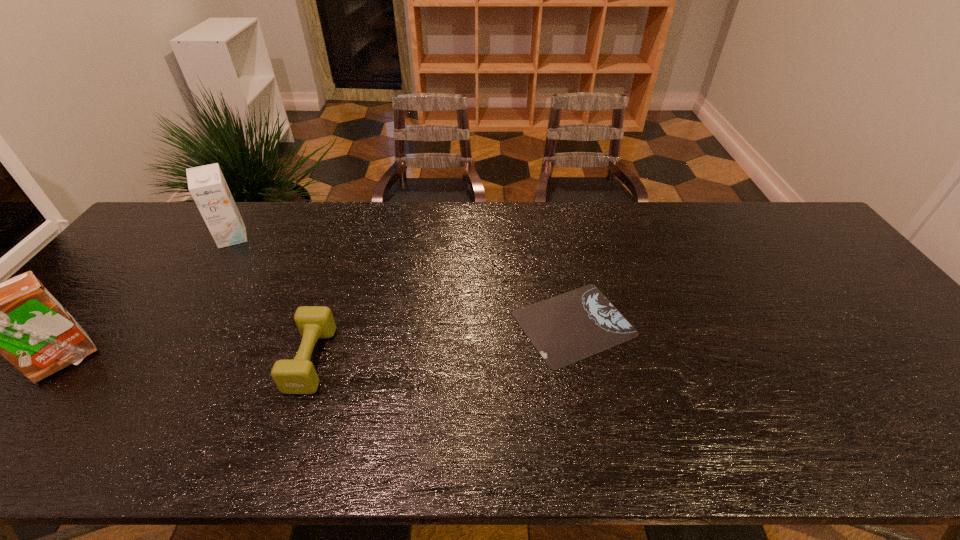
Locate an element on the screen. The width and height of the screenshot is (960, 540). the right carton is located at coordinates (207, 185).

Locate an element on the screen. This screenshot has width=960, height=540. the farther carton is located at coordinates (207, 185).

What are the coordinates of `the leftmost object` in the screenshot? It's located at [19, 319].

Locate an element on the screen. This screenshot has width=960, height=540. the nearer carton is located at coordinates (19, 319).

Find the location of a particular element. the second shortest object is located at coordinates (292, 376).

You are a GUI agent. You are given a task and a screenshot of the screen. Output one action in this format:
    pyautogui.click(x=<x>, y=<y>)
    Task: Click on the dumbbell
    The image size is (960, 540).
    Given the screenshot: What is the action you would take?
    pyautogui.click(x=292, y=376)

Find the location of a particular element. This screenshot has height=540, width=960. mousepad is located at coordinates (567, 328).

Image resolution: width=960 pixels, height=540 pixels. Find the location of `the shortest object`. the shortest object is located at coordinates (567, 328).

I want to click on vacant space positioned on the left of the farthest object, so click(x=143, y=238).

The height and width of the screenshot is (540, 960). I want to click on free spot located on the straw side of the left carton, so click(x=201, y=360).